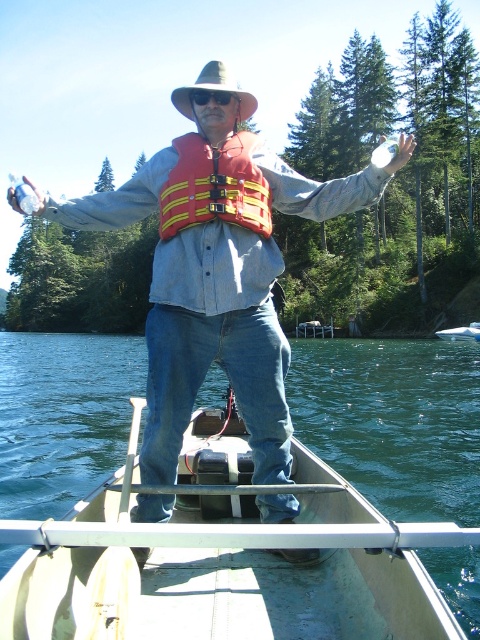
Question: Can you confirm if denim jeans at center is positioned above red/yellow fabric life jacket at center?

Choices:
 (A) yes
 (B) no

Answer: (A)

Question: Which object is closer to the camera taking this photo?

Choices:
 (A) brown felt cowboy hat at center
 (B) white plastic boat at center
 (C) denim jeans at center
 (D) red/yellow fabric life jacket at center

Answer: (C)

Question: Is denim jeans at center positioned behind red/yellow fabric life jacket at center?

Choices:
 (A) yes
 (B) no

Answer: (B)

Question: Which of the following is the closest to the observer?

Choices:
 (A) (187, 100)
 (B) (224, 204)

Answer: (B)

Question: Which point is closer to the camera?

Choices:
 (A) (225, 80)
 (B) (469, 324)

Answer: (A)

Question: Does wooden canoe at center appear over brown felt cowboy hat at center?

Choices:
 (A) no
 (B) yes

Answer: (A)